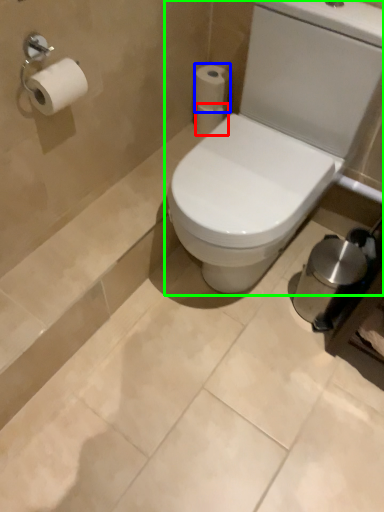
Question: Based on their relative distances, which object is farther from toilet paper (highlighted by a red box)? Choose from toilet paper (highlighted by a blue box) and toilet (highlighted by a green box).

Choices:
 (A) toilet paper
 (B) toilet

Answer: (B)